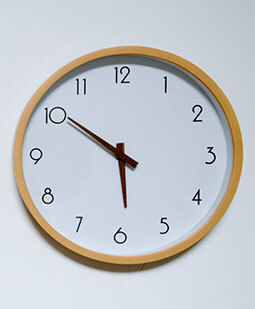
The height and width of the screenshot is (309, 255). In order to click on clock in this screenshot , I will do `click(174, 168)`.